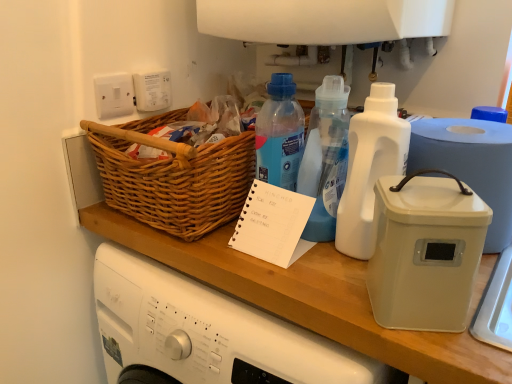
Question: Is white plastic container at right aimed at white plastic bottle at center, the 1th bottle when ordered from left to right?

Choices:
 (A) no
 (B) yes

Answer: (A)

Question: Is white plastic container at right outside white plastic bottle at center, the 1th bottle when ordered from left to right?

Choices:
 (A) no
 (B) yes

Answer: (B)

Question: Does white plastic container at right have a greater height compared to white plastic bottle at center, the second bottle viewed from the right?

Choices:
 (A) no
 (B) yes

Answer: (A)

Question: Is white plastic container at right closer to camera compared to white plastic bottle at center, the second bottle viewed from the right?

Choices:
 (A) yes
 (B) no

Answer: (A)

Question: Does white plastic container at right lie behind white plastic bottle at center, the second bottle viewed from the right?

Choices:
 (A) yes
 (B) no

Answer: (B)

Question: Does white plastic container at right have a lesser width compared to white plastic bottle at center, the 1th bottle when ordered from left to right?

Choices:
 (A) no
 (B) yes

Answer: (A)

Question: Is white plastic bottle at center-right, which ranks as the 1th bottle in right-to-left order, outside white paper notepad at center?

Choices:
 (A) yes
 (B) no

Answer: (A)

Question: From the image's perspective, is white plastic bottle at center-right, the second bottle positioned from the left, beneath white paper notepad at center?

Choices:
 (A) yes
 (B) no

Answer: (B)

Question: From a real-world perspective, is white plastic bottle at center-right, which ranks as the 1th bottle in right-to-left order, positioned under white paper notepad at center based on gravity?

Choices:
 (A) yes
 (B) no

Answer: (B)

Question: Is the depth of white plastic bottle at center-right, the second bottle positioned from the left, greater than that of white paper notepad at center?

Choices:
 (A) yes
 (B) no

Answer: (B)

Question: From a real-world perspective, is white plastic bottle at center-right, the second bottle positioned from the left, on white paper notepad at center?

Choices:
 (A) no
 (B) yes

Answer: (B)

Question: Can you confirm if white plastic bottle at center-right, the second bottle positioned from the left, is wider than white paper notepad at center?

Choices:
 (A) yes
 (B) no

Answer: (B)

Question: Is white plastic bottle at center, the second bottle viewed from the right, surrounded by white plastic container at right?

Choices:
 (A) yes
 (B) no

Answer: (B)